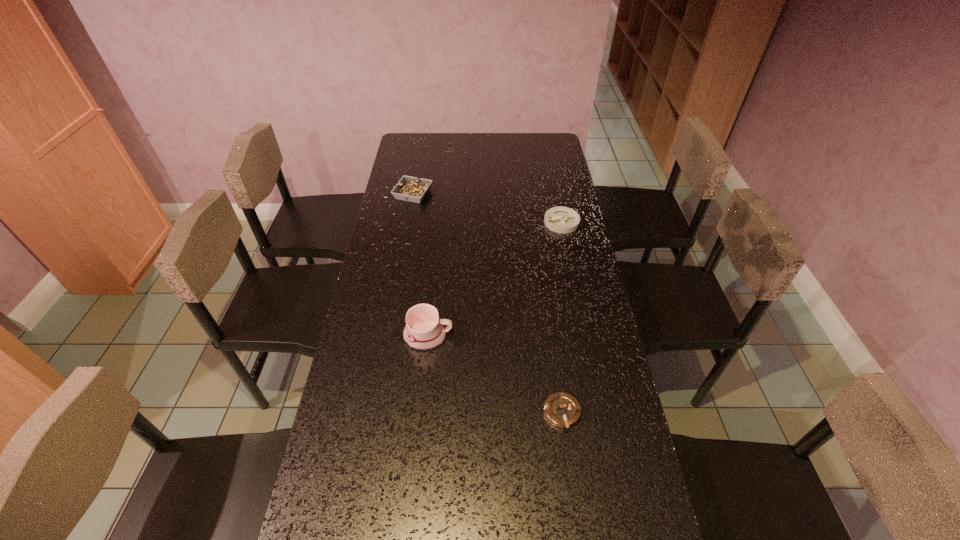
Identify which ashtray is located as the second nearest to the second farthest ashtray. Please provide its 2D coordinates. Your answer should be formatted as a tuple, i.e. [(x, y)], where the tuple contains the x and y coordinates of a point satisfying the conditions above.

[(561, 409)]

Where is `vacant space that satisfies the following two spatial constraints: 1. on the side with the handle of the shortest object; 2. on the right side of the third farthest object`? The height and width of the screenshot is (540, 960). vacant space that satisfies the following two spatial constraints: 1. on the side with the handle of the shortest object; 2. on the right side of the third farthest object is located at coordinates (420, 413).

The height and width of the screenshot is (540, 960). In order to click on free space in the image that satisfies the following two spatial constraints: 1. on the front side of the second farthest object; 2. on the left side of the farthest ashtray in this screenshot , I will do `click(408, 222)`.

The height and width of the screenshot is (540, 960). In order to click on vacant space that satisfies the following two spatial constraints: 1. on the side with the handle of the second nearest object; 2. on the left side of the shortest object in this screenshot , I will do point(420,413).

Find the location of `blank area in the image that satisfies the following two spatial constraints: 1. on the front side of the second farthest object; 2. on the side with the handle of the second nearest object`. blank area in the image that satisfies the following two spatial constraints: 1. on the front side of the second farthest object; 2. on the side with the handle of the second nearest object is located at coordinates (585, 336).

Find the location of a particular element. Image resolution: width=960 pixels, height=540 pixels. free space that satisfies the following two spatial constraints: 1. on the side with the handle of the mug; 2. on the left side of the nearest object is located at coordinates (420, 413).